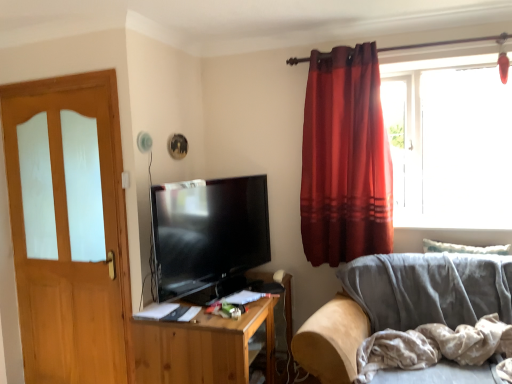
Question: Is there a large distance between light brown wood door at left and velvet gray couch at lower right?

Choices:
 (A) yes
 (B) no

Answer: (A)

Question: From a real-world perspective, is light brown wood door at left over velvet gray couch at lower right?

Choices:
 (A) no
 (B) yes

Answer: (B)

Question: Is light brown wood door at left with velvet gray couch at lower right?

Choices:
 (A) no
 (B) yes

Answer: (A)

Question: Does light brown wood door at left have a larger size compared to velvet gray couch at lower right?

Choices:
 (A) yes
 (B) no

Answer: (B)

Question: Can you confirm if light brown wood door at left is thinner than velvet gray couch at lower right?

Choices:
 (A) no
 (B) yes

Answer: (B)

Question: Is light brown wood door at left in front of or behind wooden tv stand at center in the image?

Choices:
 (A) front
 (B) behind

Answer: (B)

Question: Is point (81, 350) closer or farther from the camera than point (268, 332)?

Choices:
 (A) closer
 (B) farther

Answer: (B)

Question: Is light brown wood door at left inside or outside of wooden tv stand at center?

Choices:
 (A) outside
 (B) inside

Answer: (A)

Question: From a real-world perspective, is light brown wood door at left physically located above or below wooden tv stand at center?

Choices:
 (A) above
 (B) below

Answer: (A)

Question: In terms of size, does matte black tv at center appear bigger or smaller than velvet gray couch at lower right?

Choices:
 (A) small
 (B) big

Answer: (A)

Question: From the image's perspective, is matte black tv at center above or below velvet gray couch at lower right?

Choices:
 (A) below
 (B) above

Answer: (B)

Question: Considering their positions, is matte black tv at center located in front of or behind velvet gray couch at lower right?

Choices:
 (A) behind
 (B) front

Answer: (A)

Question: Considering the positions of matte black tv at center and velvet gray couch at lower right in the image, is matte black tv at center wider or thinner than velvet gray couch at lower right?

Choices:
 (A) wide
 (B) thin

Answer: (B)

Question: From the image's perspective, is light gray cotton blanket at lower right located above or below transparent glass window at upper right?

Choices:
 (A) above
 (B) below

Answer: (B)

Question: Does point (509, 344) appear closer or farther from the camera than point (503, 168)?

Choices:
 (A) farther
 (B) closer

Answer: (B)